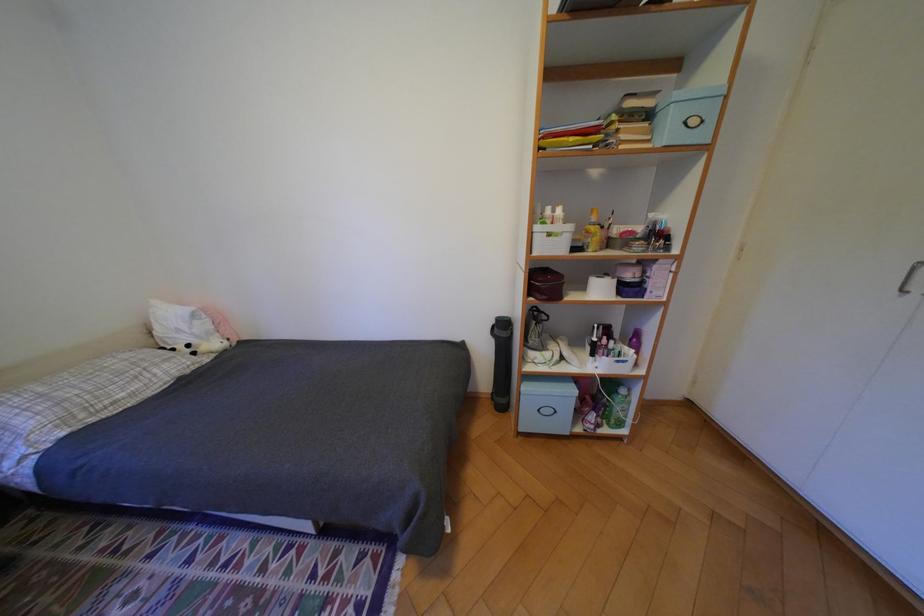
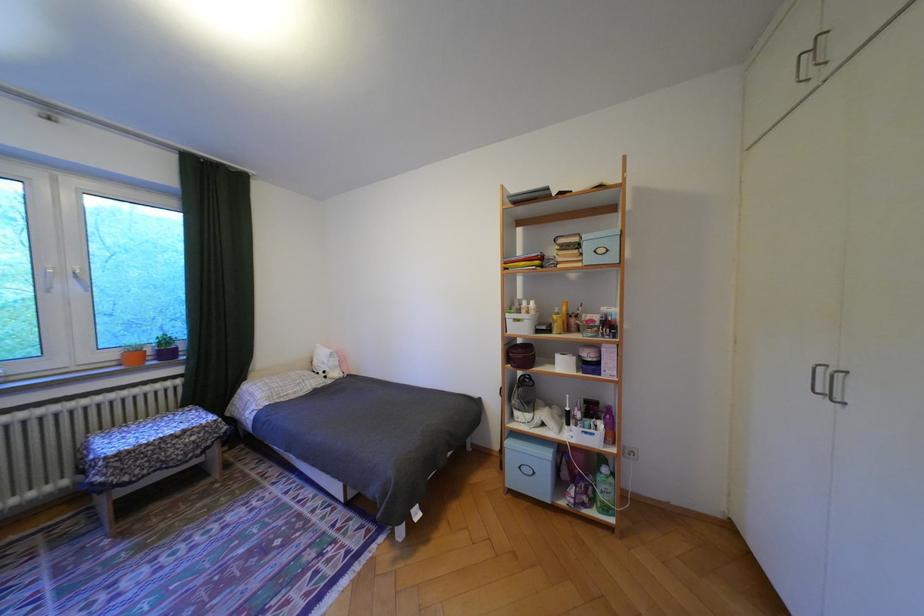
Locate, in the second image, the point that corresponds to point 550,228 in the first image.

(518, 315)